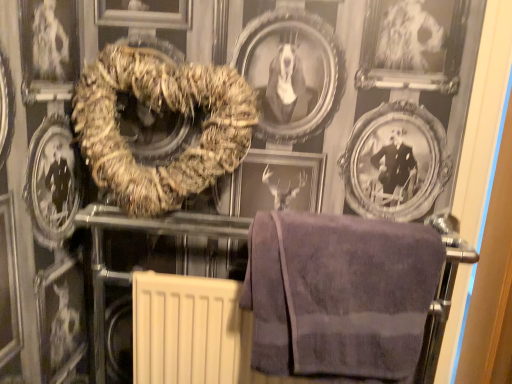
Question: From a real-world perspective, relative to brown textured towel at center, positioned as the first towel in top-to-bottom order, is purple terry cloth towel at lower right, placed as the second towel when sorted from top to bottom, vertically above or below?

Choices:
 (A) below
 (B) above

Answer: (A)

Question: In terms of size, does purple terry cloth towel at lower right, which appears as the 1th towel when ordered from the bottom, appear bigger or smaller than brown textured towel at center, positioned as the first towel in top-to-bottom order?

Choices:
 (A) small
 (B) big

Answer: (A)

Question: Based on their positions, is purple terry cloth towel at lower right, which is counted as the 2th towel, starting from the left, located to the left or right of brown textured towel at center, arranged as the first towel when viewed from the left?

Choices:
 (A) right
 (B) left

Answer: (A)

Question: In terms of width, does brown textured towel at center, arranged as the first towel when viewed from the left, look wider or thinner when compared to purple terry cloth towel at lower right, which appears as the 1th towel when viewed from the right?

Choices:
 (A) thin
 (B) wide

Answer: (A)

Question: Does point (92, 142) appear closer or farther from the camera than point (342, 269)?

Choices:
 (A) farther
 (B) closer

Answer: (A)

Question: Considering their positions, is brown textured towel at center, marked as the second towel in a bottom-to-top arrangement, located in front of or behind purple terry cloth towel at lower right, which appears as the 1th towel when viewed from the right?

Choices:
 (A) front
 (B) behind

Answer: (B)

Question: Is brown textured towel at center, marked as the second towel in a bottom-to-top arrangement, bigger or smaller than purple terry cloth towel at lower right, which is counted as the 2th towel, starting from the left?

Choices:
 (A) big
 (B) small

Answer: (A)